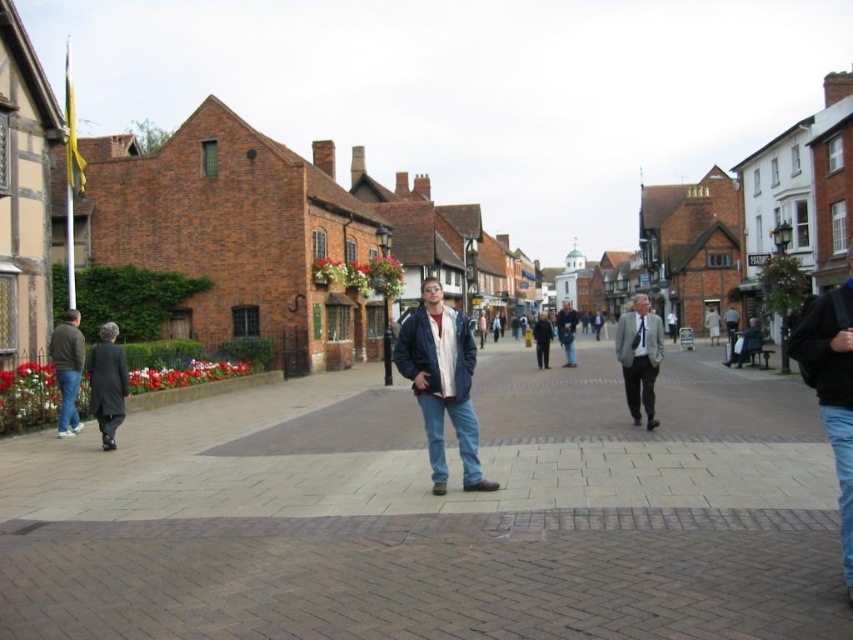
You are a tailor who needs to determine which garment requires more fabric to alter. Based on the scene, which item would need more fabric, the dark gray wool coat at left or the dark blue jacket at center?

The dark blue jacket at center requires more fabric since it is larger than the dark gray wool coat at left.

Based on the photo, you are a tailor observing the jackets in the historic town square scene. You need to determine the spatial relationship between the dark brown leather jacket at left and the dark blue jacket at center. Which jacket is positioned lower in the image?

The dark brown leather jacket at left is below the dark blue jacket at center, so it is positioned lower in the image.

Based on the photo, you are standing in the historic town square and want to walk from the man to the point closer to you. Which point should you head towards, point (498, 484) or point (817, 342)?

You should head towards point (498, 484) because it is closer to you than point (817, 342).